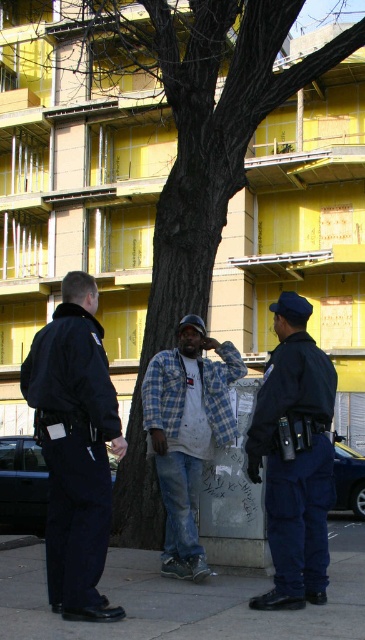
You are a construction worker standing near the tree and the building under construction. You need to pass between the blue uniformed officer at center and the plaid fabric shirt at center to reach the construction site. Can you safely walk through the space between them?

The blue uniformed officer at center is narrower than the plaid fabric shirt at center, so there should be enough space for you to walk between them safely.

You are a construction worker standing near the tree and the building under construction. You need to pass a tool to the dark blue uniform at center and the blue uniformed officer at center. Can you reach both of them without moving from your current position?

The dark blue uniform at center and blue uniformed officer at center are 3.66 feet apart. Since the distance between them is within a typical arm reach, you can likely pass the tool to both without moving from your position.

You are a pedestrian trying to cross the street near the construction site. You notice two officers in the scene. Which officer, the dark blue uniform at center or the blue uniformed officer at center, is closer to you?

The dark blue uniform at center is larger in size compared to the blue uniformed officer at center, indicating it is closer to you.